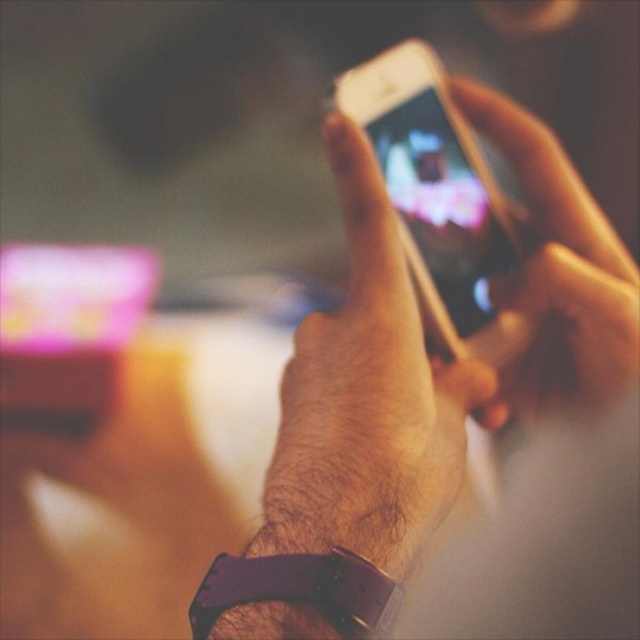
You are a photographer trying to adjust the focus of your camera to capture the metallic gold phone at center. According to the scene description, where should you aim the focus point to ensure the phone is in sharp focus?

You should aim the focus point at coordinates point (435,360) to ensure the metallic gold phone at center is in sharp focus.

Consider the image. You are a photographer trying to capture the metallic gold phone at center. The camera you are using has a focus point at coordinate point (435, 360). Will the metallic gold phone at center be in focus?

The point (435, 360) is where the metallic gold phone at center is located, so yes, the metallic gold phone at center will be in focus because the focus point is exactly at its location.